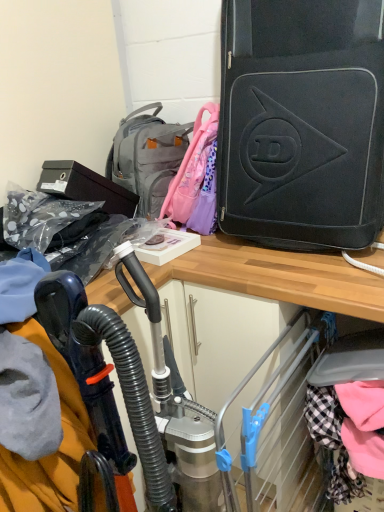
Question: Should I look upward or downward to see metallic silver vacuum cleaner at center?

Choices:
 (A) up
 (B) down

Answer: (B)

Question: Is metallic silver vacuum cleaner at center positioned with its back to black matte suitcase at upper right?

Choices:
 (A) yes
 (B) no

Answer: (B)

Question: Can you confirm if metallic silver vacuum cleaner at center is smaller than black matte suitcase at upper right?

Choices:
 (A) no
 (B) yes

Answer: (B)

Question: From the image's perspective, does metallic silver vacuum cleaner at center appear higher than black matte suitcase at upper right?

Choices:
 (A) no
 (B) yes

Answer: (A)

Question: Is metallic silver vacuum cleaner at center taller than black matte suitcase at upper right?

Choices:
 (A) no
 (B) yes

Answer: (B)

Question: Is metallic silver vacuum cleaner at center outside of black matte suitcase at upper right?

Choices:
 (A) yes
 (B) no

Answer: (A)

Question: From the image's perspective, is metallic silver vacuum cleaner at center located beneath black matte suitcase at upper right?

Choices:
 (A) no
 (B) yes

Answer: (B)

Question: Is metallic silver vacuum cleaner at center completely or partially inside gray fabric backpack at upper center?

Choices:
 (A) yes
 (B) no

Answer: (B)

Question: Is gray fabric backpack at upper center positioned in front of metallic silver vacuum cleaner at center?

Choices:
 (A) yes
 (B) no

Answer: (B)

Question: From a real-world perspective, does gray fabric backpack at upper center stand above metallic silver vacuum cleaner at center?

Choices:
 (A) yes
 (B) no

Answer: (A)

Question: From the image's perspective, is gray fabric backpack at upper center located beneath metallic silver vacuum cleaner at center?

Choices:
 (A) no
 (B) yes

Answer: (A)

Question: Is gray fabric backpack at upper center located outside metallic silver vacuum cleaner at center?

Choices:
 (A) no
 (B) yes

Answer: (B)

Question: Can you confirm if gray fabric backpack at upper center is positioned to the left of metallic silver vacuum cleaner at center?

Choices:
 (A) yes
 (B) no

Answer: (A)

Question: Is the depth of metallic silver vacuum cleaner at center less than that of gray fabric backpack at upper center?

Choices:
 (A) yes
 (B) no

Answer: (A)